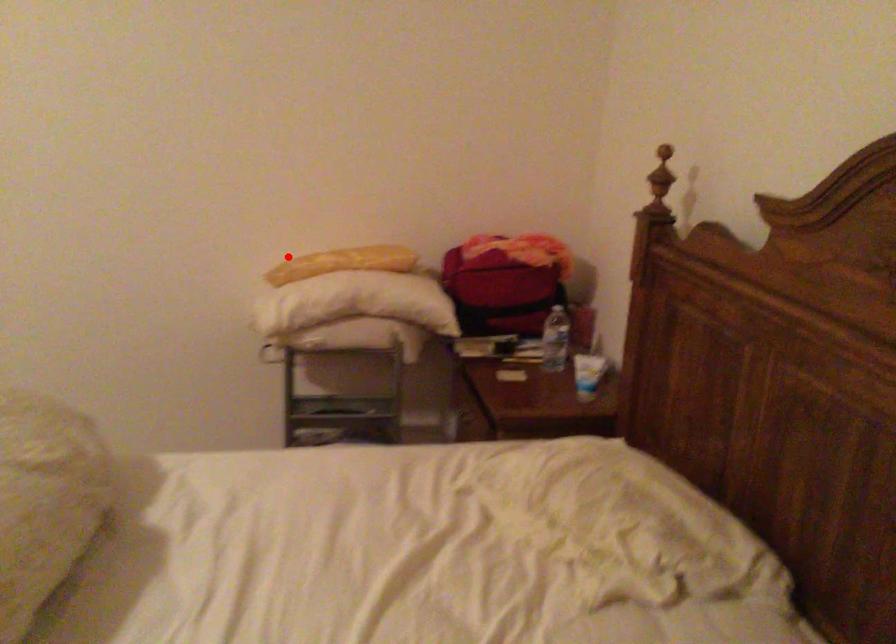
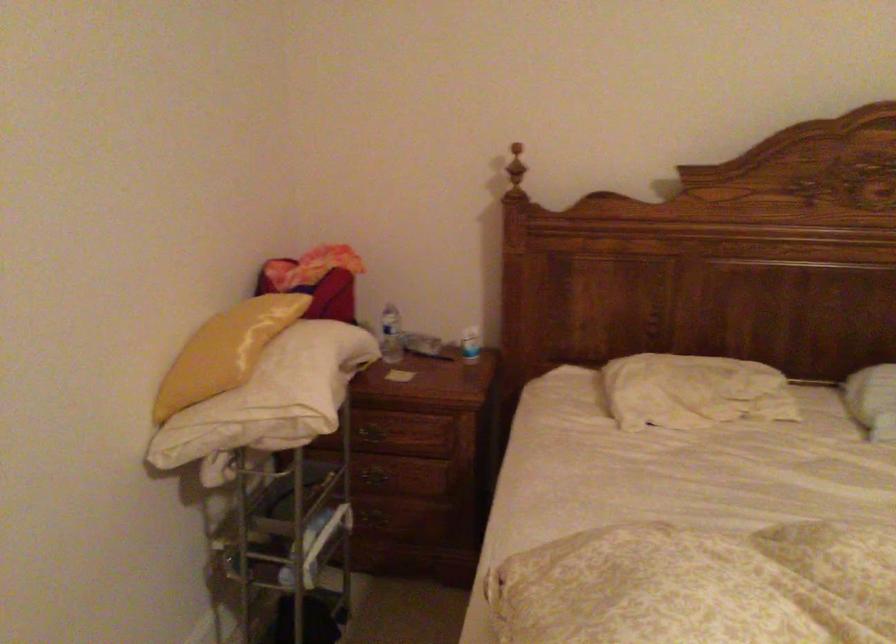
Question: I am providing you with two images of the same scene from different viewpoints. Given a red point in image1, look at the same physical point in image2. Is it:

Choices:
 (A) Closer to the viewpoint
 (B) Farther from the viewpoint

Answer: (A)